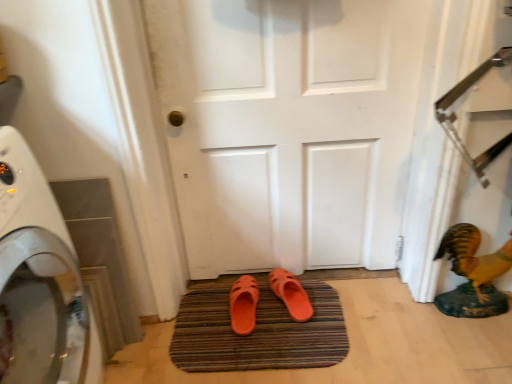
Question: Is white glossy washing machine at left to the left or to the right of white matte door at center in the image?

Choices:
 (A) right
 (B) left

Answer: (B)

Question: From a real-world perspective, is white glossy washing machine at left above or below white matte door at center?

Choices:
 (A) below
 (B) above

Answer: (A)

Question: Based on their relative distances, which object is nearer to the orange rubber slipper at center, the 2th footwear positioned from the left?

Choices:
 (A) orange rubber slipper at center, the 1th footwear from the left
 (B) orange rubber bath mat at center
 (C) white glossy washing machine at left
 (D) white matte door at center
 (E) shiny gold statue at lower right

Answer: (A)

Question: Which of these objects is positioned farthest from the white matte door at center?

Choices:
 (A) white glossy washing machine at left
 (B) orange rubber slipper at center, the 2th footwear positioned from the left
 (C) shiny gold statue at lower right
 (D) orange rubber slipper at center, the 2th footwear from the right
 (E) orange rubber bath mat at center

Answer: (A)